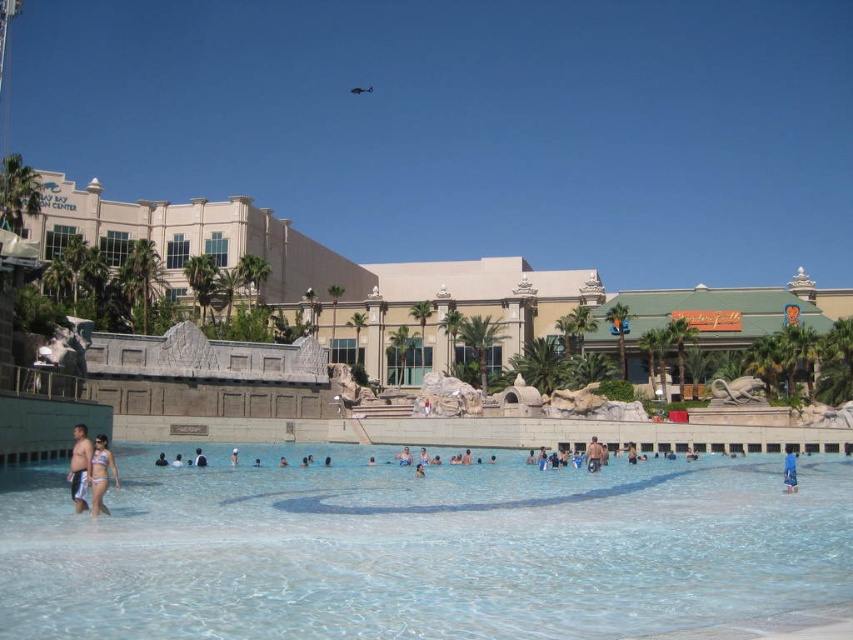
Consider the image. You are standing at the resort pool and want to know how far the point at coordinates (93, 492) is from your current position. Can you determine the distance?

The point at coordinates (93, 492) is 48.90 meters away from your current position.

You are standing at the entrance of the resort and want to locate the clear glass pool at center. According to the coordinates provided, what are the exact coordinates where you should look to find it?

The clear glass pool at center is located at coordinates point (422, 550).